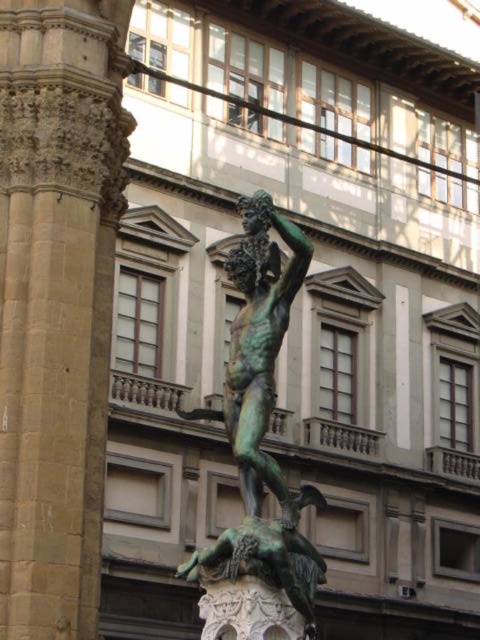
Which is more to the right, smooth stone pillar at center or green patina bronze at center?

From the viewer's perspective, green patina bronze at center appears more on the right side.

Is point (105, 168) in front of point (199, 579)?

No, it is not.

Identify the location of smooth stone pillar at center. This screenshot has width=480, height=640. (57, 301).